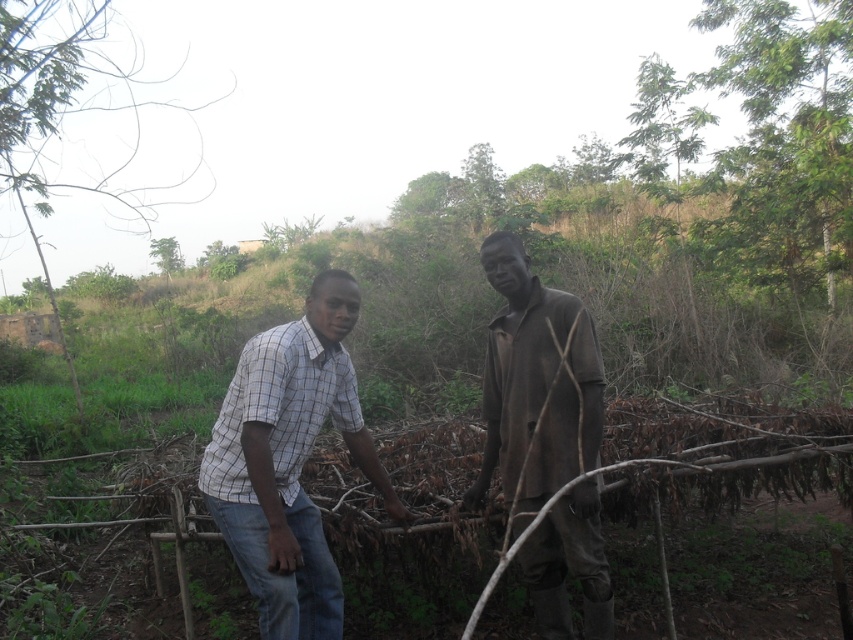
You are a photographer trying to capture a photo of the checkered fabric shirt at center and the green leafy tree at left. Based on their heights, which one will you need to adjust your camera angle upwards to focus on?

The green leafy tree at left is taller than the checkered fabric shirt at center, so you will need to adjust your camera angle upwards to focus on the green leafy tree at left.

In the scene shown: You are a photographer trying to capture a photo of the two people in the rural setting. You want to ensure that both the brown matte shirt at center and the green leafy tree at upper center are clearly visible in the frame. Based on their sizes, which object should you focus on to ensure proper focus and sharpness?

The brown matte shirt at center has a lesser width compared to the green leafy tree at upper center, so you should focus on the brown matte shirt at center first to ensure it is sharp, as it is smaller and might require more precise focusing to capture details clearly.

You are a photographer trying to capture a clear shot of both the brown matte shirt at center and the green leafy tree at upper center. Based on their positions, which object should you focus on first to ensure both are in focus?

The brown matte shirt at center is closer to the viewer than the green leafy tree at upper center. To ensure both are in focus, you should focus on the brown matte shirt at center first, as it is closer, and the tree will be in the background.